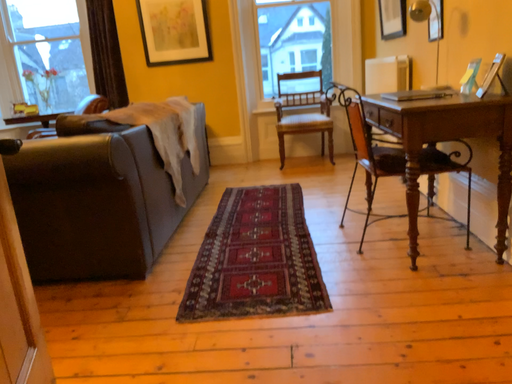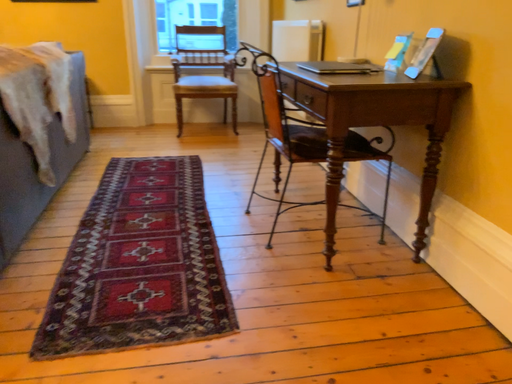
Question: How did the camera likely rotate when shooting the video?

Choices:
 (A) rotated left
 (B) rotated right

Answer: (B)